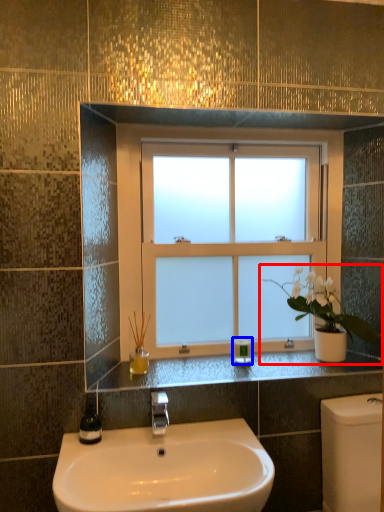
Question: Among these objects, which one is farthest to the camera, houseplant (highlighted by a red box) or toiletry (highlighted by a blue box)?

Choices:
 (A) houseplant
 (B) toiletry

Answer: (B)